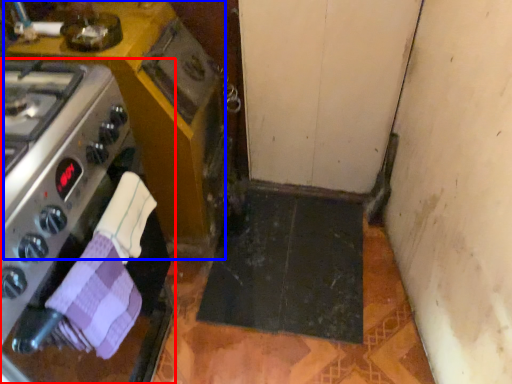
Question: Which object is further to the camera taking this photo, kitchen appliance (highlighted by a red box) or cabinetry (highlighted by a blue box)?

Choices:
 (A) kitchen appliance
 (B) cabinetry

Answer: (B)